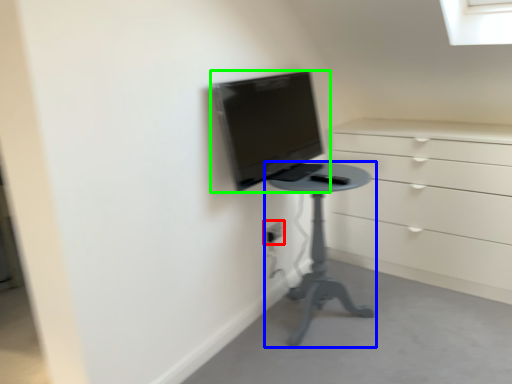
Question: Which object is the closest to the electric outlet (highlighted by a red box)? Choose among these: furniture (highlighted by a blue box) or computer monitor (highlighted by a green box).

Choices:
 (A) furniture
 (B) computer monitor

Answer: (A)